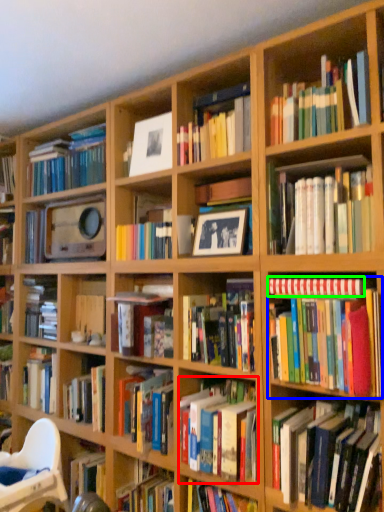
Question: Based on their relative distances, which object is nearer to book (highlighted by a red box)? Choose from book (highlighted by a blue box) and book (highlighted by a green box).

Choices:
 (A) book
 (B) book

Answer: (A)